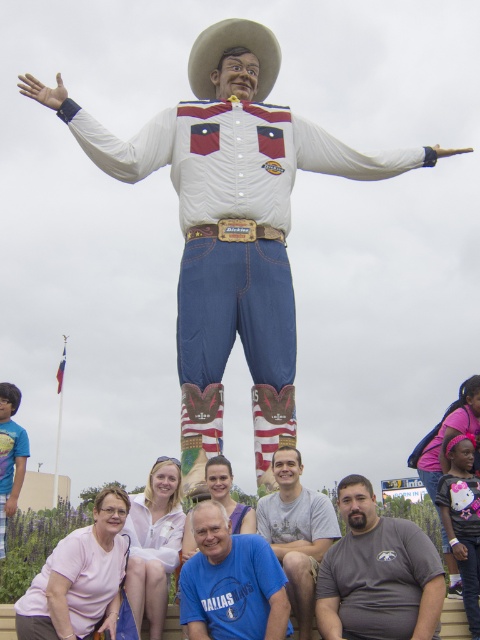
Question: Which point appears closest to the camera in this image?

Choices:
 (A) (351, 620)
 (B) (201, 65)
 (C) (377, 36)
 (D) (287, 500)

Answer: (A)

Question: Based on their relative distances, which object is farther from the gray matte shirt at lower center?

Choices:
 (A) white felt cowboy hat at upper center
 (B) gray cotton t-shirt at center
 (C) white matte cowboy at center
 (D) blue t-shirt at lower center

Answer: (A)

Question: Is gray matte shirt at lower center behind white felt cowboy hat at upper center?

Choices:
 (A) yes
 (B) no

Answer: (B)

Question: Can you confirm if blue t-shirt at lower center is thinner than gray cotton t-shirt at center?

Choices:
 (A) yes
 (B) no

Answer: (B)

Question: Which object is the closest to the white felt cowboy hat at upper center?

Choices:
 (A) white matte cowboy at center
 (B) gray matte shirt at lower center
 (C) blue t-shirt at lower center

Answer: (A)

Question: Can you confirm if blue t-shirt at lower center is positioned above gray cotton t-shirt at center?

Choices:
 (A) yes
 (B) no

Answer: (B)